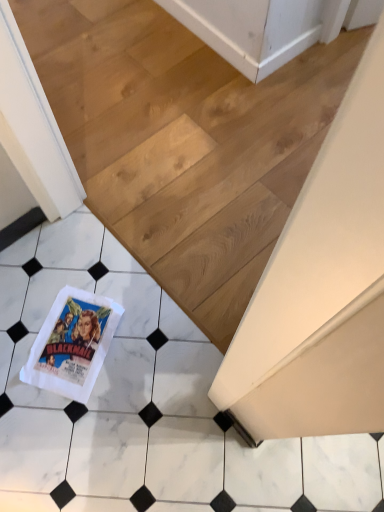
I want to click on blank area beneath white paper towel at lower left (from a real-world perspective), so (x=75, y=342).